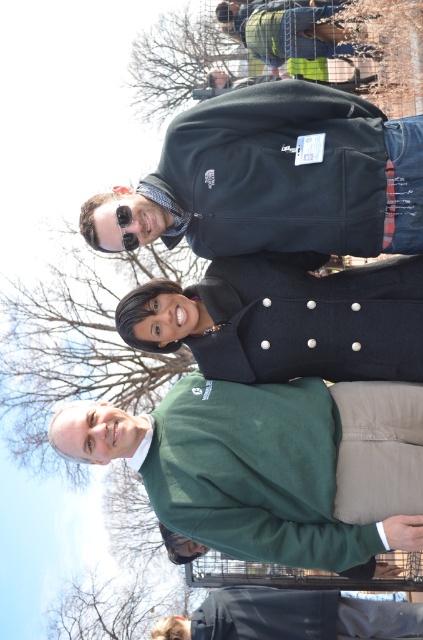
Question: Is green fleece sweater at center wider than navy wool coat at center?

Choices:
 (A) yes
 (B) no

Answer: (B)

Question: Does dark blue fleece jacket at upper center appear over navy wool coat at center?

Choices:
 (A) no
 (B) yes

Answer: (B)

Question: Based on their relative distances, which object is nearer to the black matte sunglasses at upper center?

Choices:
 (A) green fleece sweater at center
 (B) navy wool coat at center

Answer: (B)

Question: Which of these objects is positioned closest to the black matte sunglasses at upper center?

Choices:
 (A) green fleece sweater at center
 (B) navy wool coat at center

Answer: (B)

Question: Is dark blue fleece jacket at upper center wider than navy wool coat at center?

Choices:
 (A) yes
 (B) no

Answer: (B)

Question: Which object is the closest to the green fleece sweater at center?

Choices:
 (A) dark blue fleece jacket at upper center
 (B) dark blue fabric at lower center
 (C) navy wool coat at center
 (D) black matte sunglasses at upper center

Answer: (C)